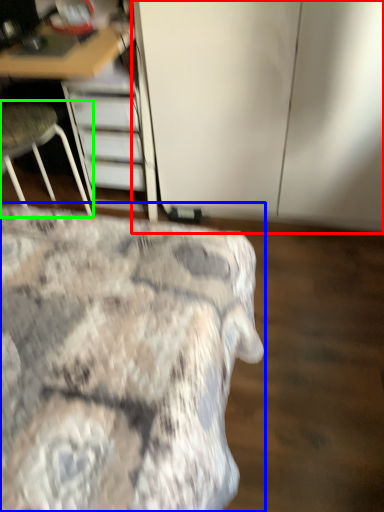
Question: Which object is the closest to the cabinetry (highlighted by a red box)? Choose among these: bed (highlighted by a blue box) or chair (highlighted by a green box).

Choices:
 (A) bed
 (B) chair

Answer: (B)